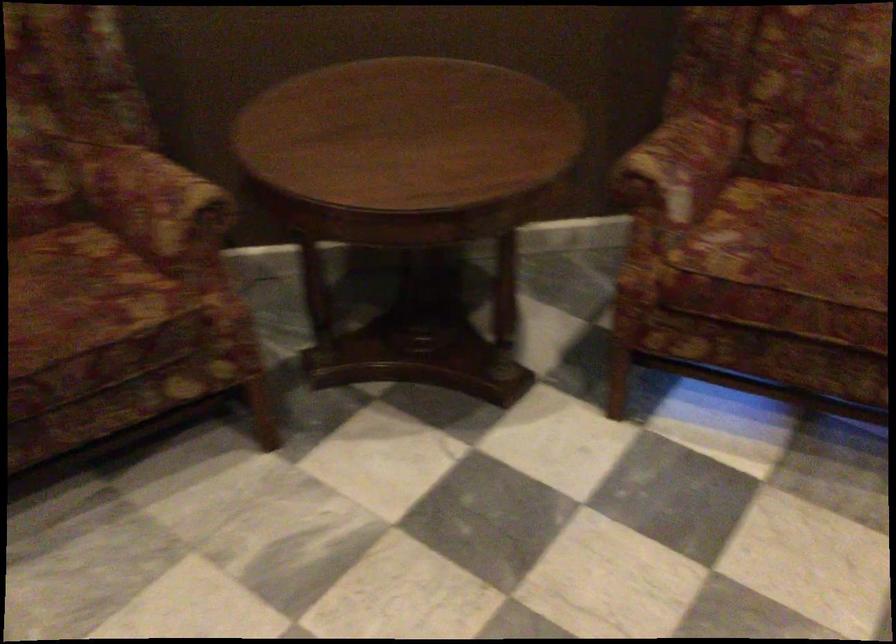
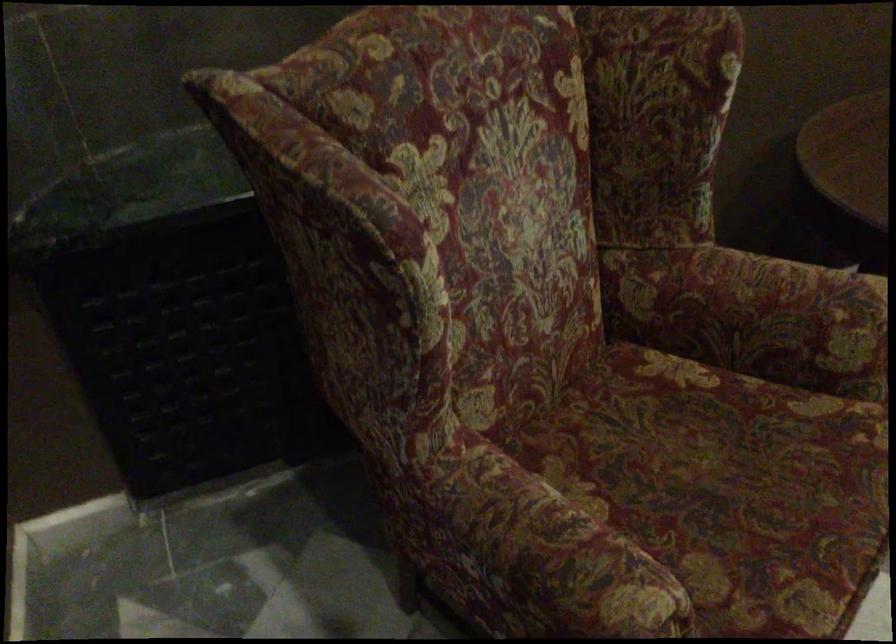
The point at (149, 212) is marked in the first image. Where is the corresponding point in the second image?

(786, 321)